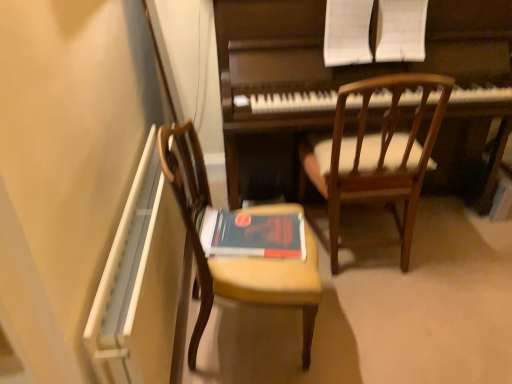
Question: In terms of height, does wooden chair at left, marked as the 2th chair in a right-to-left arrangement, look taller or shorter compared to hardcover book at center?

Choices:
 (A) tall
 (B) short

Answer: (A)

Question: From a real-world perspective, is wooden chair at left, positioned as the first chair in left-to-right order, positioned above or below hardcover book at center?

Choices:
 (A) below
 (B) above

Answer: (A)

Question: Which object is the closest to the wooden chair at left, positioned as the first chair in left-to-right order?

Choices:
 (A) hardcover book at center
 (B) dark wood piano at center
 (C) wooden chair at upper right, the second chair from the left

Answer: (A)

Question: Considering the real-world distances, which object is farthest from the dark wood piano at center?

Choices:
 (A) hardcover book at center
 (B) wooden chair at upper right, the second chair from the left
 (C) wooden chair at left, positioned as the first chair in left-to-right order

Answer: (A)